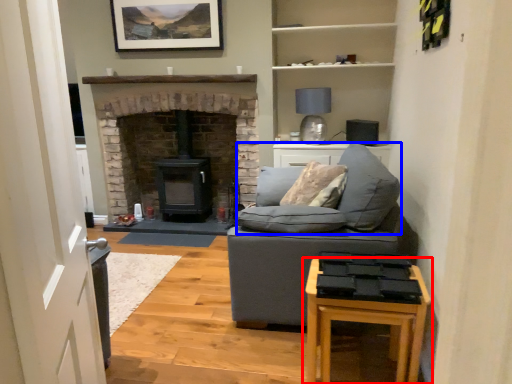
Question: Which object appears closest to the camera in this image, table (highlighted by a red box) or sit (highlighted by a blue box)?

Choices:
 (A) table
 (B) sit

Answer: (A)